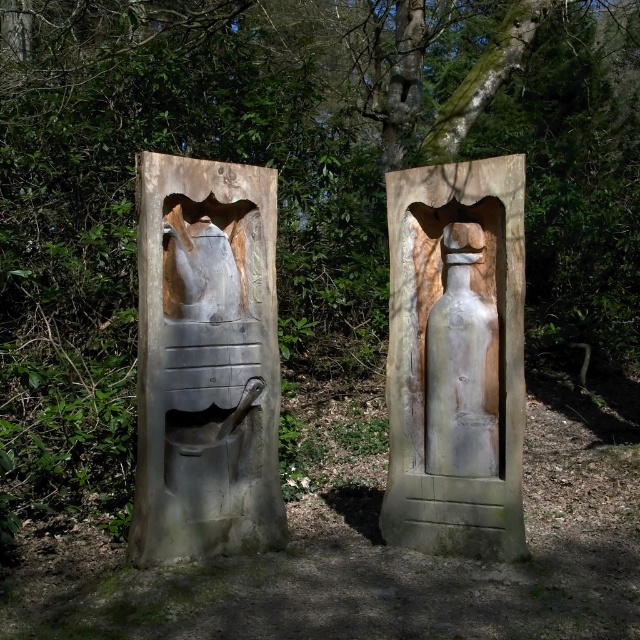
Is matte gray stone pitcher at center to the left of white matte bottle at center from the viewer's perspective?

Indeed, matte gray stone pitcher at center is positioned on the left side of white matte bottle at center.

I want to click on matte gray stone pitcher at center, so click(x=205, y=360).

Image resolution: width=640 pixels, height=640 pixels. Describe the element at coordinates (456, 358) in the screenshot. I see `white stone bottle at center` at that location.

Is white stone bottle at center wider than white matte bottle at center?

Correct, the width of white stone bottle at center exceeds that of white matte bottle at center.

Is point (432, 348) closer to viewer compared to point (460, 420)?

No, it is not.

At what (x,y) coordinates should I click in order to perform the action: click on white stone bottle at center. Please return your answer as a coordinate pair (x, y). Looking at the image, I should click on (456, 358).

Is point (204, 300) closer to camera compared to point (424, 520)?

Yes, point (204, 300) is closer to viewer.

Which is behind, point (195, 236) or point (499, 268)?

Positioned behind is point (195, 236).

Locate an element on the screen. This screenshot has height=640, width=640. matte gray stone pitcher at center is located at coordinates (205, 360).